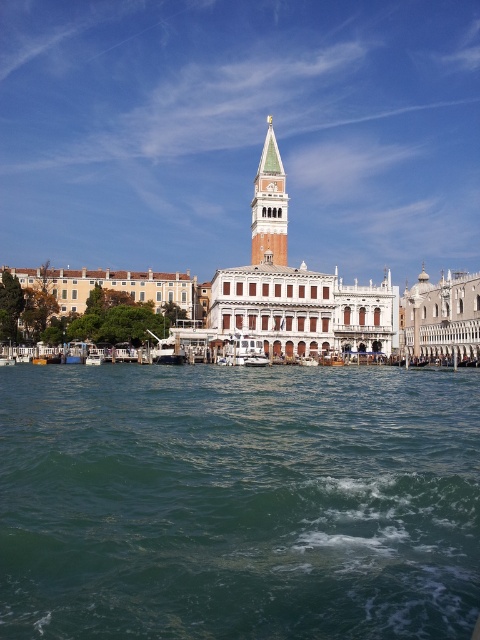
Question: Which point is closer to the camera taking this photo?

Choices:
 (A) (264, 157)
 (B) (256, 364)
 (C) (195, 410)

Answer: (C)

Question: Is green marble bell tower at upper center in front of white glossy boat at center?

Choices:
 (A) no
 (B) yes

Answer: (A)

Question: Considering the relative positions of green marble bell tower at upper center and white glossy boat at center in the image provided, where is green marble bell tower at upper center located with respect to white glossy boat at center?

Choices:
 (A) left
 (B) right

Answer: (B)

Question: Which point is closer to the camera?

Choices:
 (A) (376, 618)
 (B) (222, 364)
 (C) (261, 177)

Answer: (A)

Question: Which of the following is the closest to the observer?

Choices:
 (A) white glossy boat at center
 (B) green water at center
 (C) green marble bell tower at upper center

Answer: (B)

Question: Does green water at center have a smaller size compared to white glossy boat at center?

Choices:
 (A) no
 (B) yes

Answer: (A)